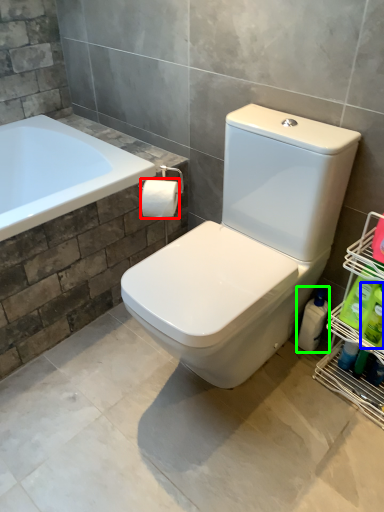
Question: Estimate the real-world distances between objects in this image. Which object is closer to toilet paper (highlighted by a red box), cleaning product (highlighted by a blue box) or cleaning product (highlighted by a green box)?

Choices:
 (A) cleaning product
 (B) cleaning product

Answer: (B)